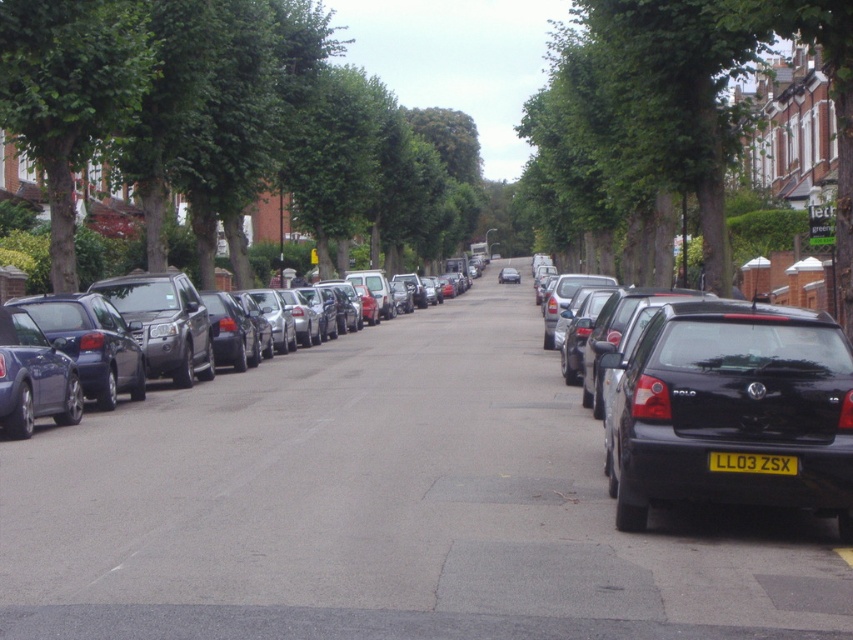
Is green leafy tree at upper left below shiny metallic car at center?

Actually, green leafy tree at upper left is above shiny metallic car at center.

Who is higher up, green leafy tree at upper left or shiny metallic car at center?

green leafy tree at upper left is above.

Is point (22, 83) positioned in front of point (215, 291)?

Yes, it is in front of point (215, 291).

The width and height of the screenshot is (853, 640). I want to click on green leafy tree at upper left, so (68, 92).

Can you confirm if green leafy tree at upper left is smaller than black plastic license plate at center?

Incorrect, green leafy tree at upper left is not smaller in size than black plastic license plate at center.

Is point (61, 257) positioned in front of point (782, 465)?

That is False.

Who is more distant from viewer, (50,20) or (715,451)?

Positioned behind is point (50,20).

What are the coordinates of `green leafy tree at upper left` in the screenshot? It's located at (68, 92).

Is green leafy tree at left below shiny metallic car at center?

Incorrect, green leafy tree at left is not positioned below shiny metallic car at center.

Does green leafy tree at left appear on the left side of shiny metallic car at center?

Yes, green leafy tree at left is to the left of shiny metallic car at center.

I want to click on green leafy tree at left, so click(x=218, y=120).

What are the coordinates of `green leafy tree at left` in the screenshot? It's located at (218, 120).